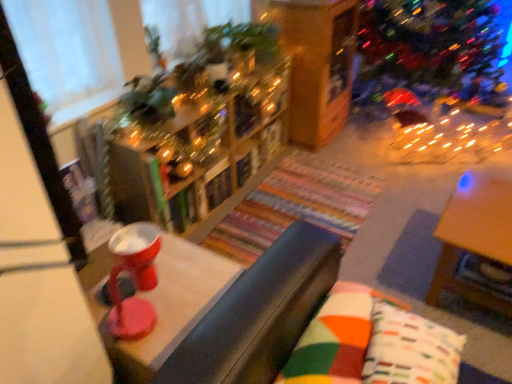
I want to click on free space above shiny plastic bowl at center, the 1th table when ordered from left to right (from a real-world perspective), so click(x=170, y=295).